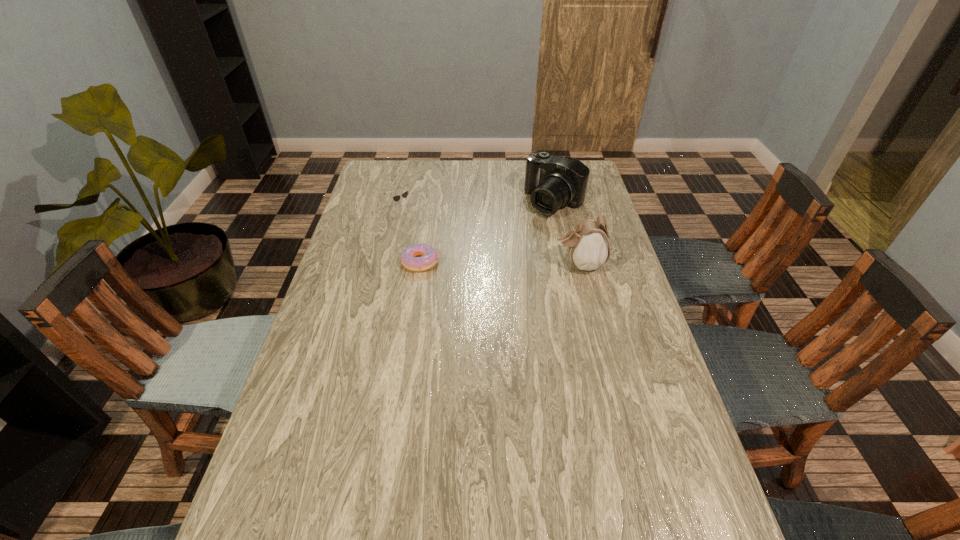
Where is `doughnut`? doughnut is located at coordinates (429, 256).

Where is `pouch`? The height and width of the screenshot is (540, 960). pouch is located at coordinates (588, 244).

In order to click on camera in this screenshot , I will do 554,182.

This screenshot has width=960, height=540. In order to click on sunglasses in this screenshot , I will do `click(396, 198)`.

Locate an element on the screen. The height and width of the screenshot is (540, 960). vacant space located on the left of the doughnut is located at coordinates (342, 262).

At what (x,y) coordinates should I click in order to perform the action: click on vacant space located on the front-facing side of the pouch. Please return your answer as a coordinate pair (x, y). Image resolution: width=960 pixels, height=540 pixels. Looking at the image, I should click on (444, 264).

Image resolution: width=960 pixels, height=540 pixels. I want to click on free space located 0.100m on the front-facing side of the pouch, so click(x=523, y=264).

Locate an element on the screen. blank space located 0.310m on the front-facing side of the pouch is located at coordinates pyautogui.click(x=457, y=264).

The height and width of the screenshot is (540, 960). In order to click on vacant space located 0.200m on the lens of the camera in this screenshot , I will do `click(509, 247)`.

What are the coordinates of `vacant space located on the lens of the camera` in the screenshot? It's located at (486, 268).